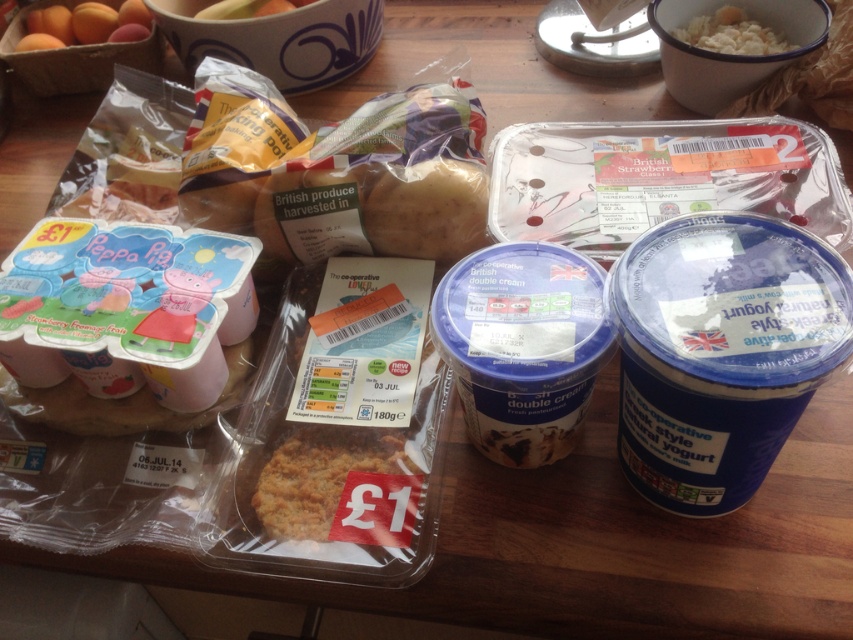
You are preparing a meal and need to know which container is taller to determine stacking space. Which is taller between the white creamy rice at upper right and the matte plastic bowl at upper center?

The white creamy rice at upper right has a greater height compared to the matte plastic bowl at upper center, so it is taller.

You are a food delivery robot with a 16 inch arm. You need to pick up the blue matte yogurt at lower right from the table. Can your arm reach it?

The blue matte yogurt at lower right is 15.82 inches away from camera, so yes, the robot can reach it with its 16 inch arm since it is slightly closer than the arm length.

You are organizing the items on the table and need to place the blue matte yogurt at lower right and the brown crumbly cake at center into a smaller shelf. Which item should you move first to ensure they fit?

The brown crumbly cake at center should be moved first because the blue matte yogurt at lower right is to the right of it, indicating it is closer to the edge and might require less adjustment to fit on the smaller shelf.